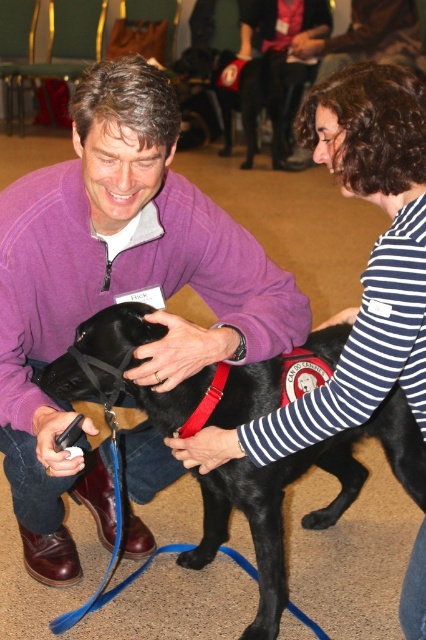
You are organizing a charity event and need to place a large donation box in the center of the room. The purple fleece sweater at center and the shiny black dog at center are currently occupying that space. Which object should you ask to move to make room for the donation box, considering their sizes?

The purple fleece sweater at center is bigger than the shiny black dog at center, so you should ask the person wearing the purple fleece sweater at center to move it since it takes up more space.

You are standing in the room and want to hand a gift to the person wearing the striped cotton shirt at center without disturbing the person in the purple fleece sweater at center. Which person should you approach first based on their positions?

You should approach the striped cotton shirt at center first because the purple fleece sweater at center is closer to you, so the striped cotton shirt at center is further away and less likely to be disturbed by approaching the closer one first.